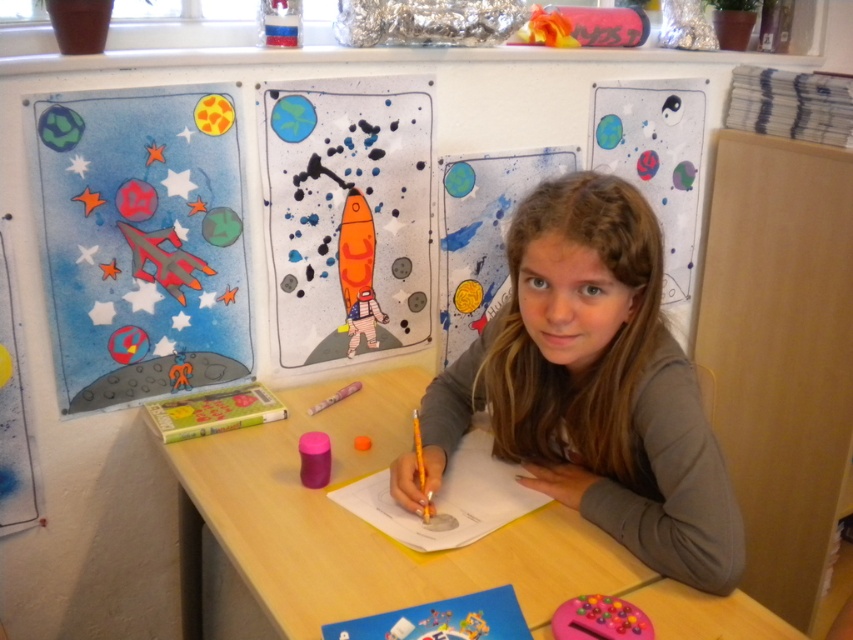
Looking at this image, can you confirm if smooth brown hair at center is positioned to the right of orange matte pencil at center?

Correct, you'll find smooth brown hair at center to the right of orange matte pencil at center.

Where is `smooth brown hair at center`? The height and width of the screenshot is (640, 853). smooth brown hair at center is located at coordinates (595, 385).

Is point (677, 385) less distant than point (419, 444)?

That is True.

I want to click on smooth brown hair at center, so click(x=595, y=385).

Is wooden table at center below orange matte pencil at center?

Correct, wooden table at center is located below orange matte pencil at center.

Does wooden table at center have a greater height compared to orange matte pencil at center?

Correct, wooden table at center is much taller as orange matte pencil at center.

Between point (376, 432) and point (415, 456), which one is positioned behind?

The point (376, 432) is more distant.

Find the location of a particular element. Image resolution: width=853 pixels, height=640 pixels. wooden table at center is located at coordinates [393, 541].

Is smooth brown hair at center shorter than wooden table at center?

No.

Describe the element at coordinates (595, 385) in the screenshot. This screenshot has width=853, height=640. I see `smooth brown hair at center` at that location.

Is point (573, 339) positioned after point (566, 586)?

Yes, point (573, 339) is farther from viewer.

This screenshot has width=853, height=640. Find the location of `smooth brown hair at center`. smooth brown hair at center is located at coordinates (595, 385).